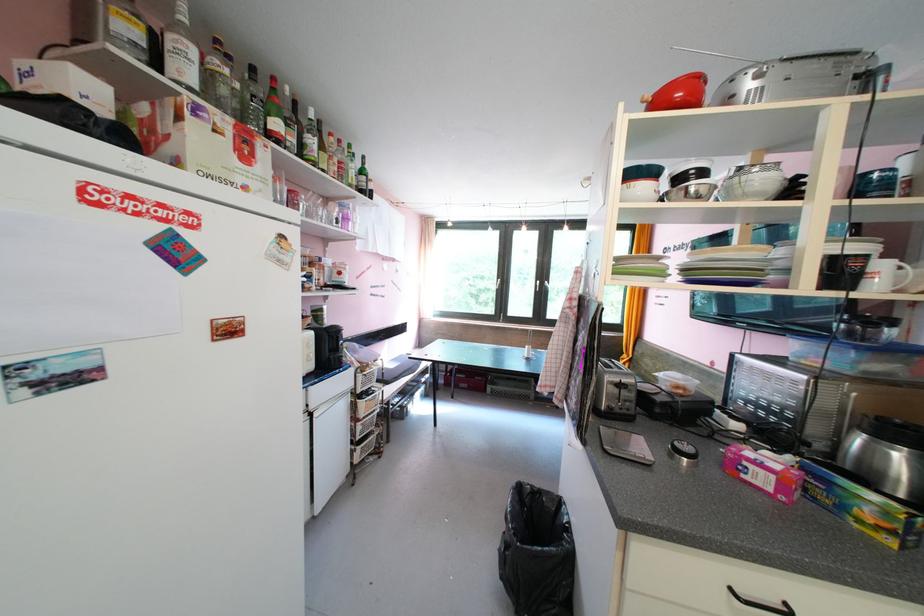
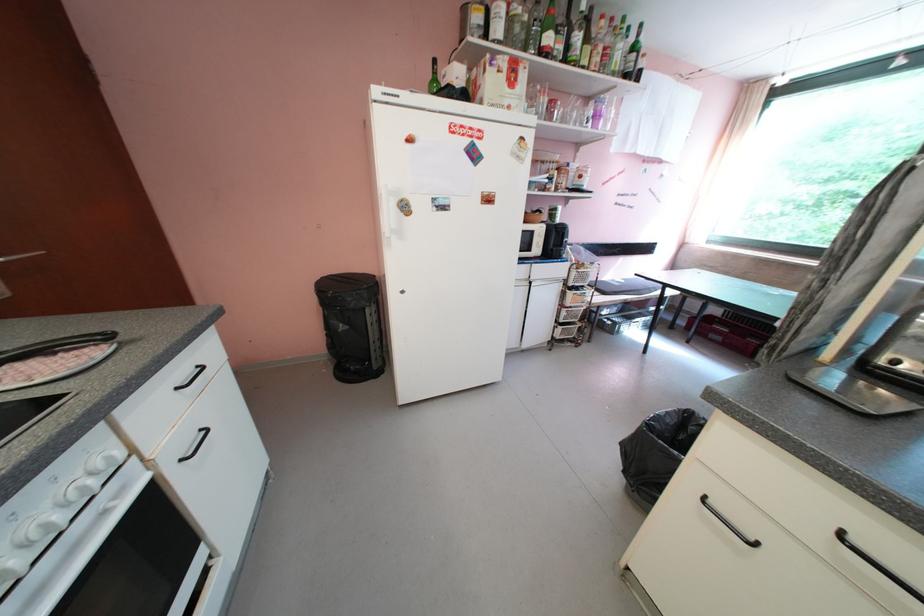
Locate, in the second image, the point that corresponds to pixel 368 450 in the first image.

(568, 330)